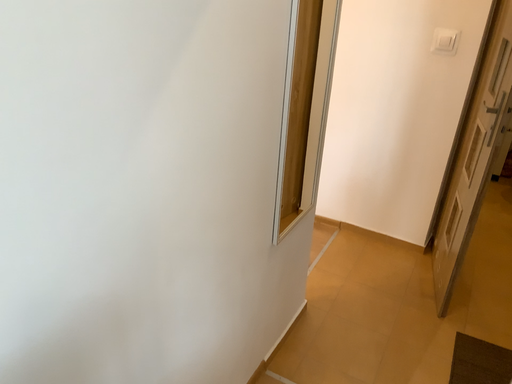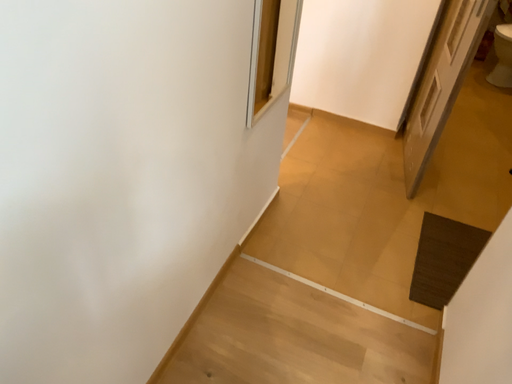
Question: How did the camera likely rotate when shooting the video?

Choices:
 (A) rotated downward
 (B) rotated upward

Answer: (A)